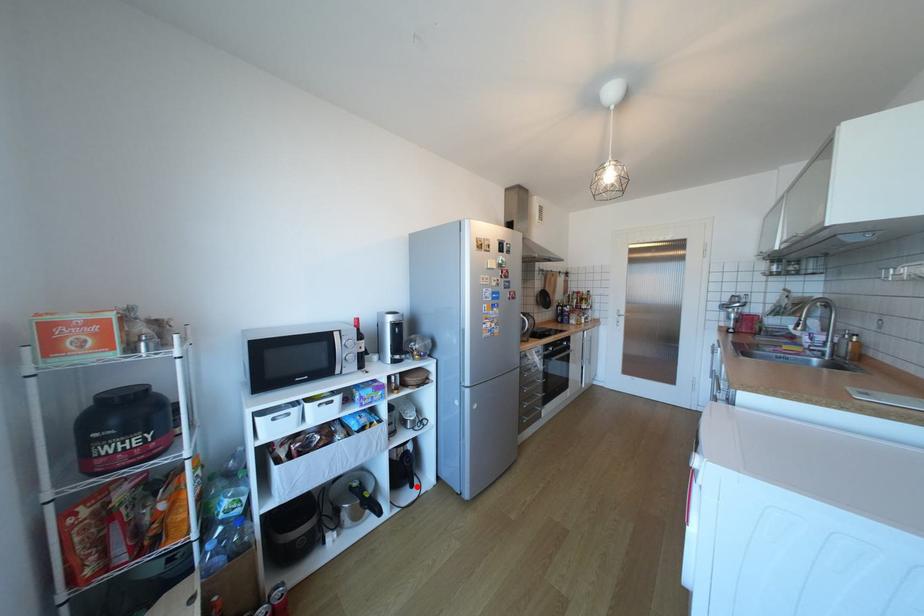
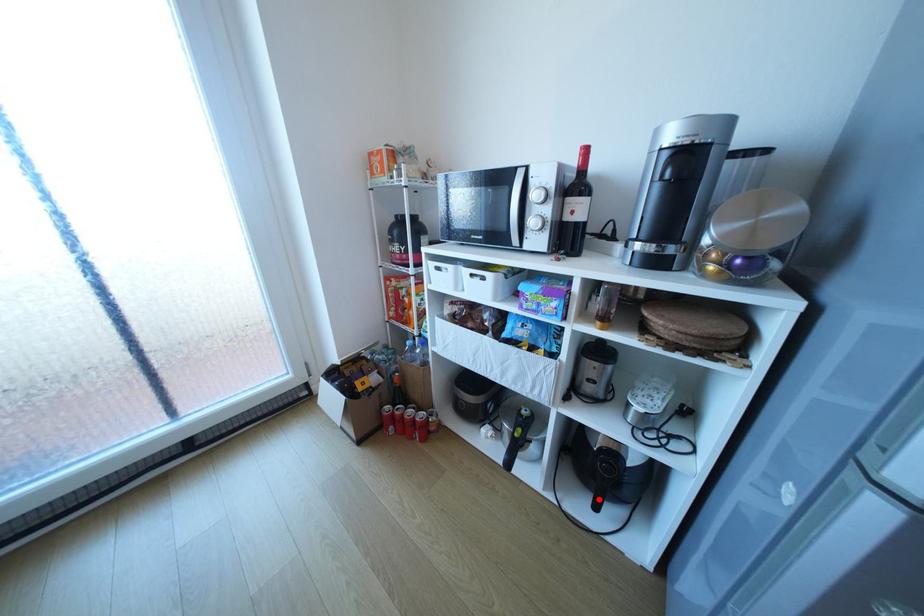
I am providing you with two images of the same scene from different viewpoints. A red point is marked on the first image and another point is marked on the second image. Is the marked point in image1 the same physical position as the marked point in image2?

Yes